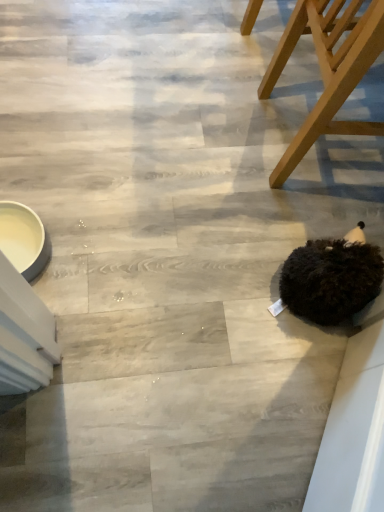
Find the location of a particular element. This screenshot has height=512, width=384. free space in front of wooden chair at upper right is located at coordinates point(283,223).